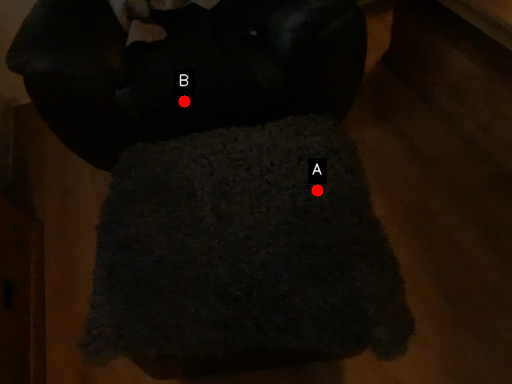
Question: Two points are circled on the image, labeled by A and B beside each circle. Which point is closer to the camera?

Choices:
 (A) A is closer
 (B) B is closer

Answer: (A)